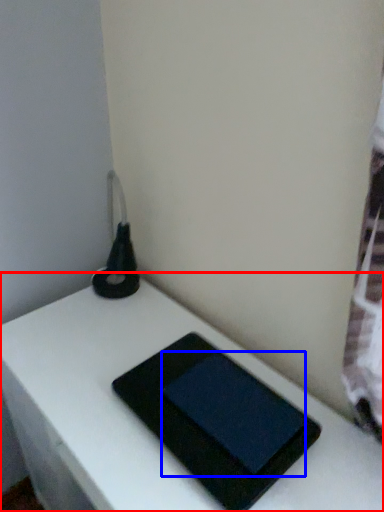
Question: Among these objects, which one is farthest to the camera, table (highlighted by a red box) or tablet computer (highlighted by a blue box)?

Choices:
 (A) table
 (B) tablet computer

Answer: (B)